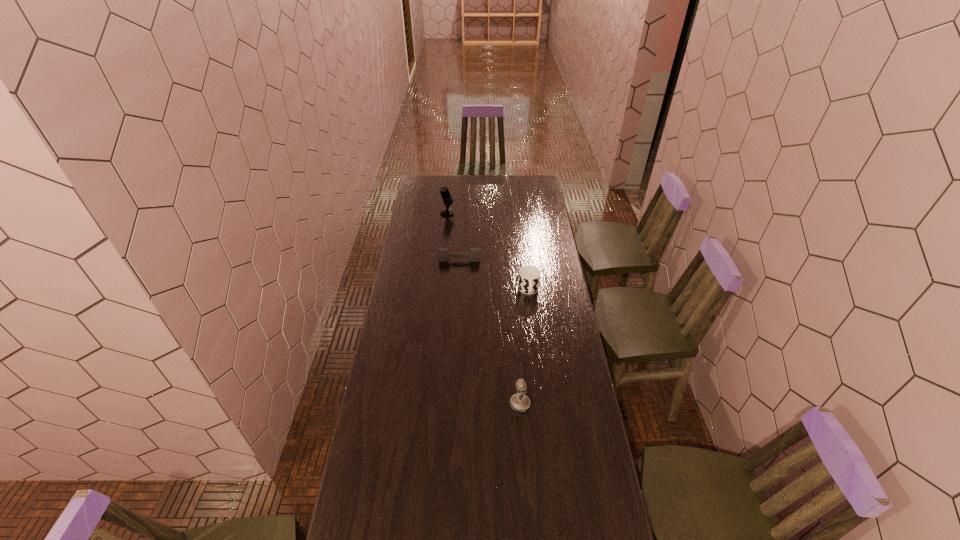
The height and width of the screenshot is (540, 960). Find the location of `vacant space in between the cup and the left microphone`. vacant space in between the cup and the left microphone is located at coordinates (488, 252).

This screenshot has height=540, width=960. I want to click on free space between the third nearest object and the third farthest object, so click(494, 275).

Locate an element on the screen. vacant space in between the farther microphone and the shorter microphone is located at coordinates (484, 309).

You are a GUI agent. You are given a task and a screenshot of the screen. Output one action in this format:
    pyautogui.click(x=<x>, y=<y>)
    Task: Click on the vacant region between the cup and the farthest object
    The height and width of the screenshot is (540, 960).
    Given the screenshot: What is the action you would take?
    pyautogui.click(x=488, y=252)

You are a GUI agent. You are given a task and a screenshot of the screen. Output one action in this format:
    pyautogui.click(x=<x>, y=<y>)
    Task: Click on the free space between the right microphone and the farther microphone
    
    Given the screenshot: What is the action you would take?
    pyautogui.click(x=484, y=309)

Find the location of a particular element. The height and width of the screenshot is (540, 960). vacant space that is in between the third tallest object and the farthest object is located at coordinates (488, 252).

The height and width of the screenshot is (540, 960). What are the coordinates of `unoccupied position between the nearer microphone and the third farthest object` in the screenshot? It's located at (524, 347).

Where is `vacant region between the third tallest object and the left microphone`? The height and width of the screenshot is (540, 960). vacant region between the third tallest object and the left microphone is located at coordinates (488, 252).

Locate an element on the screen. This screenshot has width=960, height=540. free space between the shorter microphone and the dumbbell is located at coordinates (490, 332).

Find the location of `unoccupied position between the dumbbell and the cup`. unoccupied position between the dumbbell and the cup is located at coordinates (494, 275).